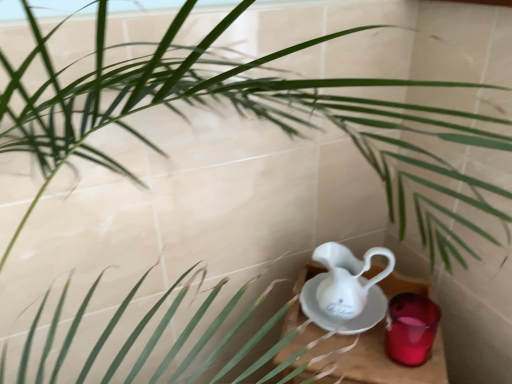
Question: Considering their positions, is wooden table at lower right located in front of or behind white porcelain jug at lower right?

Choices:
 (A) front
 (B) behind

Answer: (B)

Question: From the image's perspective, is wooden table at lower right positioned above or below white porcelain jug at lower right?

Choices:
 (A) below
 (B) above

Answer: (A)

Question: Estimate the real-world distances between objects in this image. Which object is closer to the translucent glass candle at lower right?

Choices:
 (A) white porcelain jug at lower right
 (B) wooden table at lower right

Answer: (B)

Question: Based on their relative distances, which object is farther from the wooden table at lower right?

Choices:
 (A) white porcelain jug at lower right
 (B) translucent glass candle at lower right

Answer: (A)